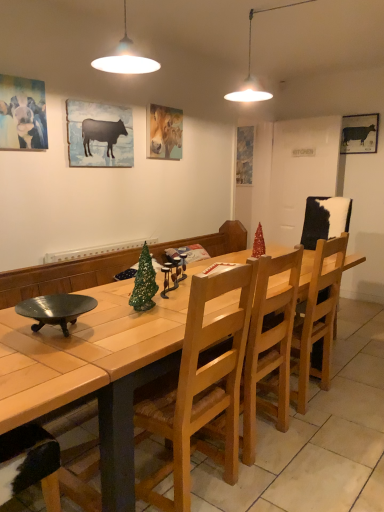
Where is `vacant space underneath shiny metallic bowl at lower left (from a real-world perspective)`? This screenshot has height=512, width=384. vacant space underneath shiny metallic bowl at lower left (from a real-world perspective) is located at coordinates (56, 335).